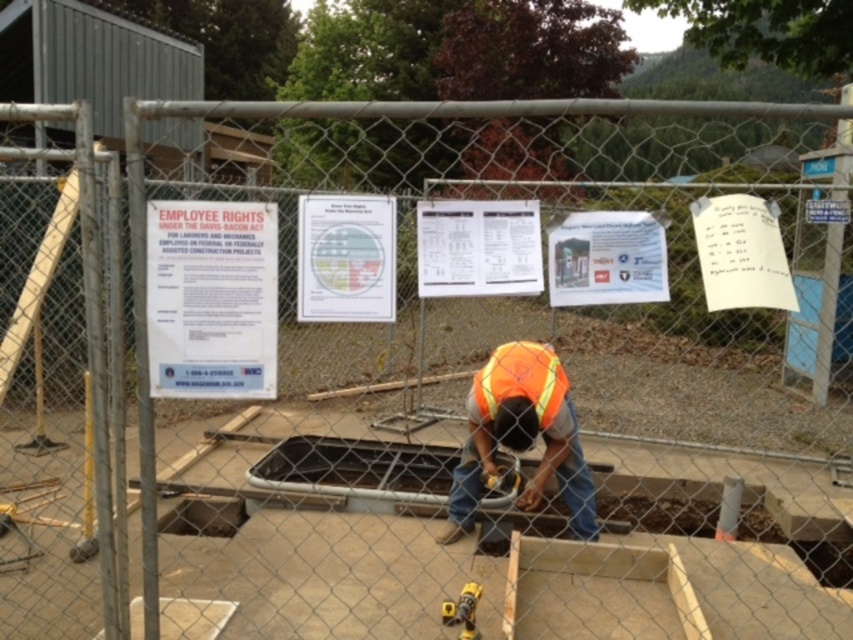
Question: Does dark gray concrete hole at center come behind concrete at center?

Choices:
 (A) yes
 (B) no

Answer: (B)

Question: Which object is the closest to the orange reflective safety vest at center?

Choices:
 (A) white paper sign at center
 (B) reflective orange vest at center

Answer: (B)

Question: Which point is closer to the camera?

Choices:
 (A) white paper sign at center
 (B) orange reflective safety vest at center
 (C) white paper sign at upper left
 (D) reflective orange vest at center

Answer: (A)

Question: Does reflective orange vest at center appear on the left side of concrete at center?

Choices:
 (A) yes
 (B) no

Answer: (A)

Question: Which object appears closest to the camera in this image?

Choices:
 (A) yellow rubber drill at center
 (B) dark gray concrete hole at center
 (C) concrete at center

Answer: (A)

Question: Does white paper sign at center lie in front of orange reflective safety vest at center?

Choices:
 (A) yes
 (B) no

Answer: (A)